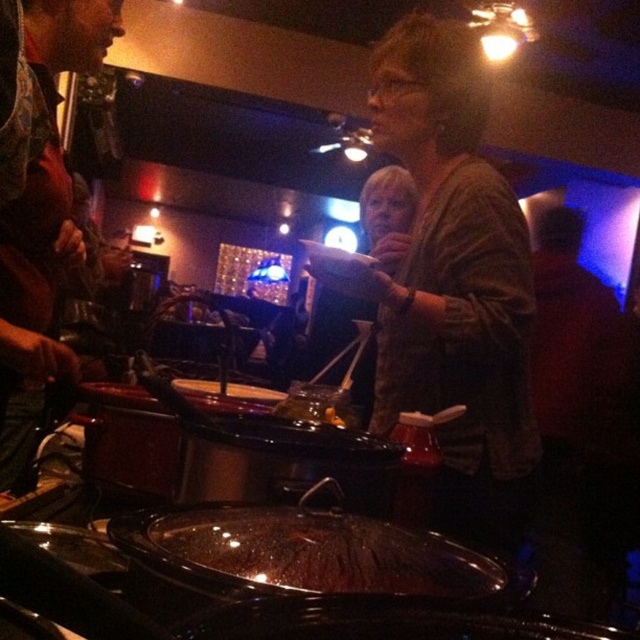
Question: Is brown textured sweater at upper right to the left of translucent glass plate at center from the viewer's perspective?

Choices:
 (A) yes
 (B) no

Answer: (B)

Question: Is brown textured sweater at upper right positioned behind translucent glass plate at center?

Choices:
 (A) yes
 (B) no

Answer: (B)

Question: Which point is farther to the camera?

Choices:
 (A) brown textured sweater at upper right
 (B) translucent glass plate at center

Answer: (B)

Question: Does brown textured sweater at upper right appear over translucent glass plate at center?

Choices:
 (A) no
 (B) yes

Answer: (B)